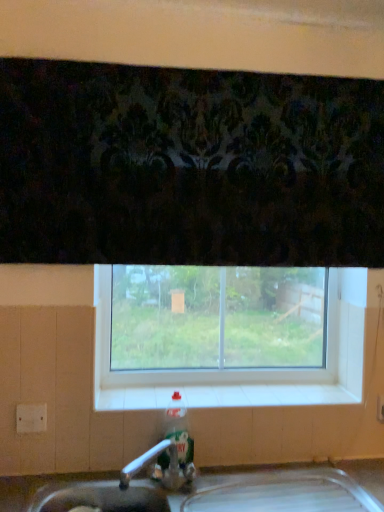
What do you see at coordinates (266, 395) in the screenshot? I see `white tile at center` at bounding box center [266, 395].

What is the approximate height of white tile at center?

white tile at center is 0.55 inches in height.

Image resolution: width=384 pixels, height=512 pixels. Find the location of `clear glass window at center`. clear glass window at center is located at coordinates (204, 371).

This screenshot has height=512, width=384. I want to click on white tile at center, so click(266, 395).

From a real-world perspective, is translucent plastic bottle at sink physically located above or below clear glass window at center?

Clearly, from a real-world perspective, translucent plastic bottle at sink is below clear glass window at center.

Based on their positions, is translucent plastic bottle at sink located to the left or right of clear glass window at center?

From the image, it's evident that translucent plastic bottle at sink is to the left of clear glass window at center.

Between translucent plastic bottle at sink and clear glass window at center, which one has larger size?

clear glass window at center.

Is translucent plastic bottle at sink oriented towards clear glass window at center?

No, translucent plastic bottle at sink does not turn towards clear glass window at center.

Based on their sizes in the image, would you say translucent plastic bottle at sink is bigger or smaller than white tile at center?

Clearly, translucent plastic bottle at sink is smaller in size than white tile at center.

Based on the photo, visually, is translucent plastic bottle at sink positioned to the left or to the right of white tile at center?

translucent plastic bottle at sink is positioned on white tile at center's left side.

Which object is more forward, translucent plastic bottle at sink or white tile at center?

translucent plastic bottle at sink is in front.

Who is taller, translucent plastic bottle at sink or white tile at center?

translucent plastic bottle at sink.

Considering their positions, is clear glass window at center located in front of or behind translucent plastic bottle at sink?

Clearly, clear glass window at center is behind translucent plastic bottle at sink.

At what (x,y) coordinates should I click in order to perform the action: click on window on the right of translucent plastic bottle at sink. Please return your answer as a coordinate pair (x, y). The width and height of the screenshot is (384, 512). Looking at the image, I should click on (204, 371).

Is clear glass window at center surrounding translucent plastic bottle at sink?

That's incorrect, translucent plastic bottle at sink is not inside clear glass window at center.

Consider the image. From a real-world perspective, is clear glass window at center on translucent plastic bottle at sink?

Indeed, from a real-world perspective, clear glass window at center stands above translucent plastic bottle at sink.

From the image's perspective, which one is positioned lower, white tile at center or clear glass window at center?

white tile at center appears lower in the image.

Is white tile at center smaller than clear glass window at center?

Yes, white tile at center is smaller than clear glass window at center.

Between white tile at center and clear glass window at center, which one has smaller width?

clear glass window at center.

Does white tile at center come behind clear glass window at center?

No, white tile at center is in front of clear glass window at center.

Is point (98, 399) behind point (169, 408)?

Yes.

Is white tile at center oriented away from translucent plastic bottle at sink?

white tile at center is not turned away from translucent plastic bottle at sink.

Looking at this image, is white tile at center positioned far away from translucent plastic bottle at sink?

They are positioned close to each other.

Is white tile at center not inside translucent plastic bottle at sink?

Yes.

Is clear glass window at center looking in the opposite direction of white tile at center?

clear glass window at center is not turned away from white tile at center.

Is clear glass window at center thinner than white tile at center?

Yes.

From the picture: Between clear glass window at center and white tile at center, which one is positioned in front?

Positioned in front is white tile at center.

From the image's perspective, is clear glass window at center under white tile at center?

Incorrect, from the image's perspective, clear glass window at center is higher than white tile at center.

I want to click on window that appears on the right of translucent plastic bottle at sink, so click(204, 371).

Locate an element on the screen. This screenshot has width=384, height=512. window sill located above the translucent plastic bottle at sink (from a real-world perspective) is located at coordinates (266, 395).

Considering their positions, is translucent plastic bottle at sink positioned closer to white tile at center than clear glass window at center?

Based on the image, clear glass window at center appears to be nearer to white tile at center.

Considering their positions, is clear glass window at center positioned further to white tile at center than translucent plastic bottle at sink?

translucent plastic bottle at sink is positioned further to the anchor white tile at center.

From the image, which object appears to be nearer to translucent plastic bottle at sink, white tile at center or clear glass window at center?

Among the two, white tile at center is located nearer to translucent plastic bottle at sink.

Looking at the image, which one is located further to translucent plastic bottle at sink, clear glass window at center or white tile at center?

clear glass window at center.

Based on their spatial positions, is translucent plastic bottle at sink or white tile at center further from clear glass window at center?

Based on the image, translucent plastic bottle at sink appears to be further to clear glass window at center.

Which object lies further to the anchor point clear glass window at center, white tile at center or translucent plastic bottle at sink?

translucent plastic bottle at sink lies further to clear glass window at center than the other object.

The width and height of the screenshot is (384, 512). In order to click on window sill between clear glass window at center and translucent plastic bottle at sink vertically in this screenshot , I will do `click(266, 395)`.